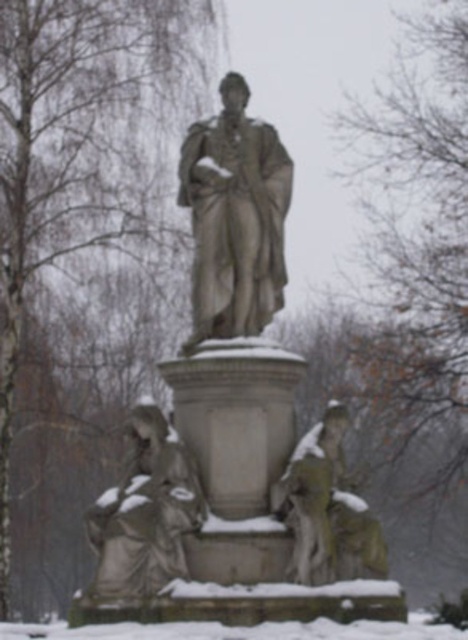
You are standing in front of a statue in a winter setting. You notice a point marked at coordinates (234, 218). What object is located at that specific point?

The gray stone statue at center is located at point (234, 218).

You are standing in front of the statue and want to take a photo of the bare branches at upper center. Where should you look to capture them in your camera viewfinder?

To capture the bare branches at upper center, look towards the coordinates point at (418, 244).

You are standing in front of the statue and want to move from the point at coordinates point (x=211, y=179) to the point at coordinates point (x=267, y=628). Can you walk directly forward without changing direction?

Since point (x=211, y=179) is behind point (x=267, y=628), you can walk directly forward without changing direction to reach it.